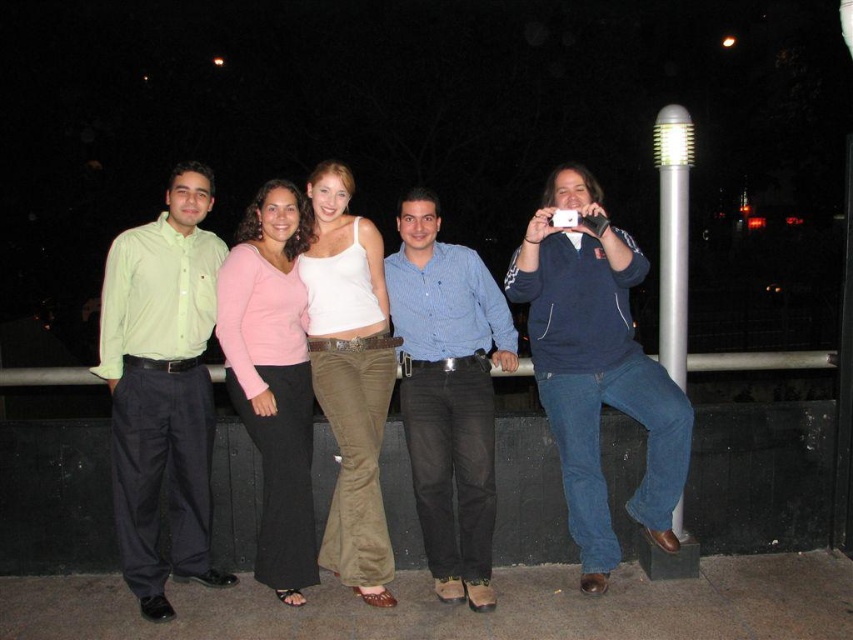
You are a photographer trying to capture a clear shot of the blue cotton hoodie at right and the silver metallic pole at right. Which object should you focus on first if you want to ensure both are in focus without adjusting your camera settings?

The blue cotton hoodie at right is taller than the silver metallic pole at right, so focusing on the blue cotton hoodie at right first would help ensure both are in focus since it is larger and more prominent in the frame.

You are a photographer trying to capture the group photo at night. You want to ensure the blue cotton hoodie at right is visible in the photo. Where should you position the camera relative to the group to include the hoodie?

To ensure the blue cotton hoodie at right is visible in the photo, position the camera so it captures the area at point (596, 369) where the hoodie is located.

You are a photographer trying to capture a clear shot of the blue cotton hoodie at right and the silver metallic pole at right. Which object should you focus on first to ensure it appears sharp in your photo?

The blue cotton hoodie at right is closer to the viewer than the silver metallic pole at right, so you should focus on the blue cotton hoodie at right first to ensure it appears sharp.